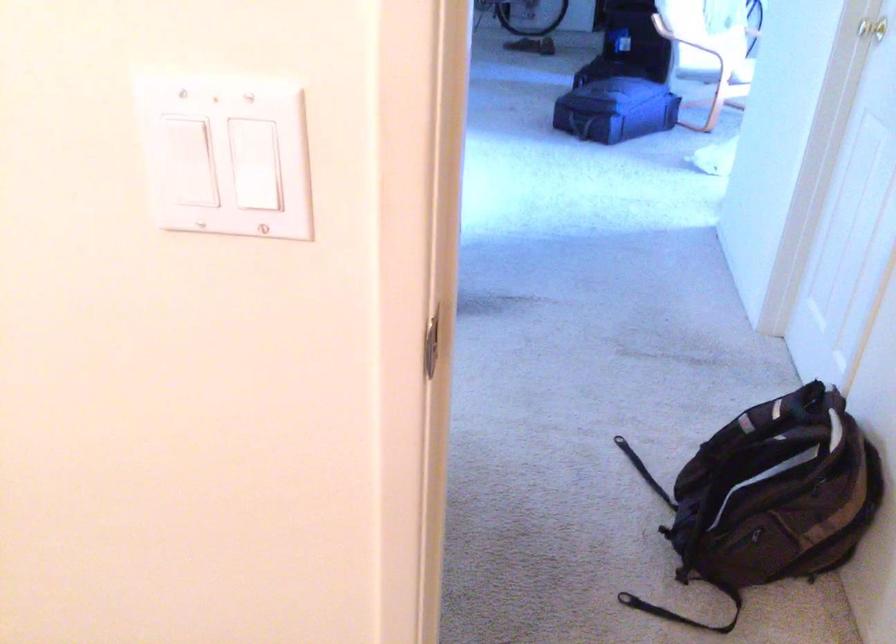
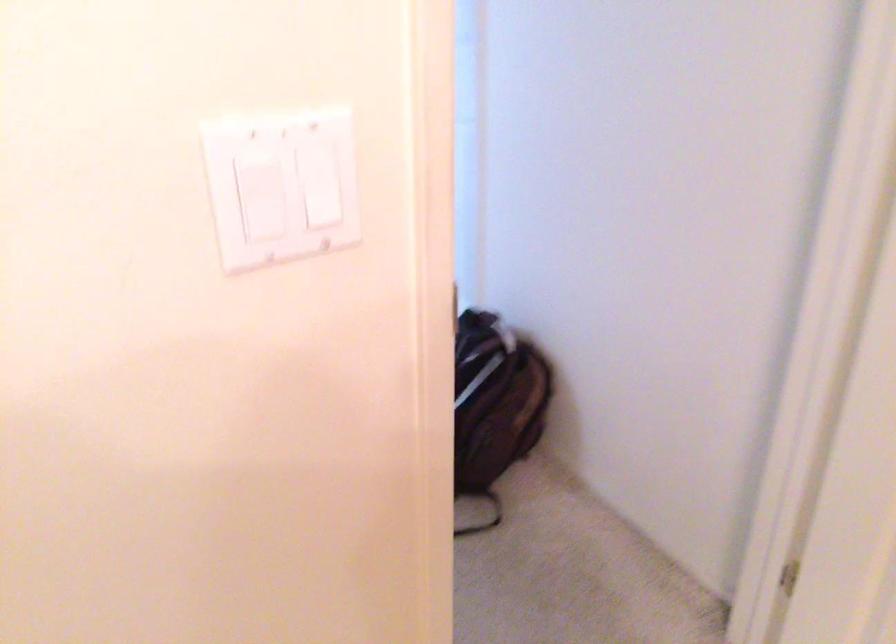
Question: The camera is either moving clockwise (left) or counter-clockwise (right) around the object. The first image is from the beginning of the video and the second image is from the end. Is the camera moving left or right when shooting the video?

Choices:
 (A) Left
 (B) Right

Answer: (A)